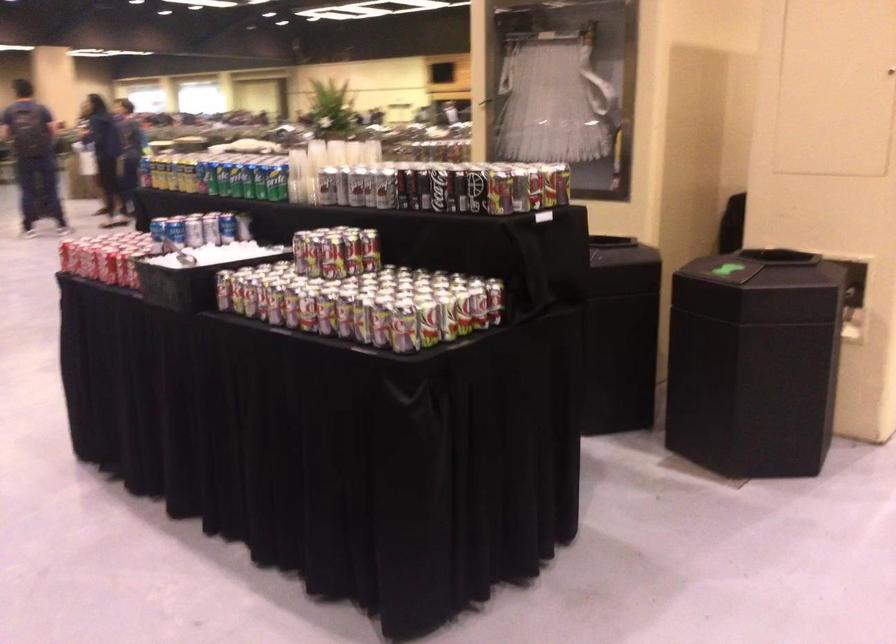
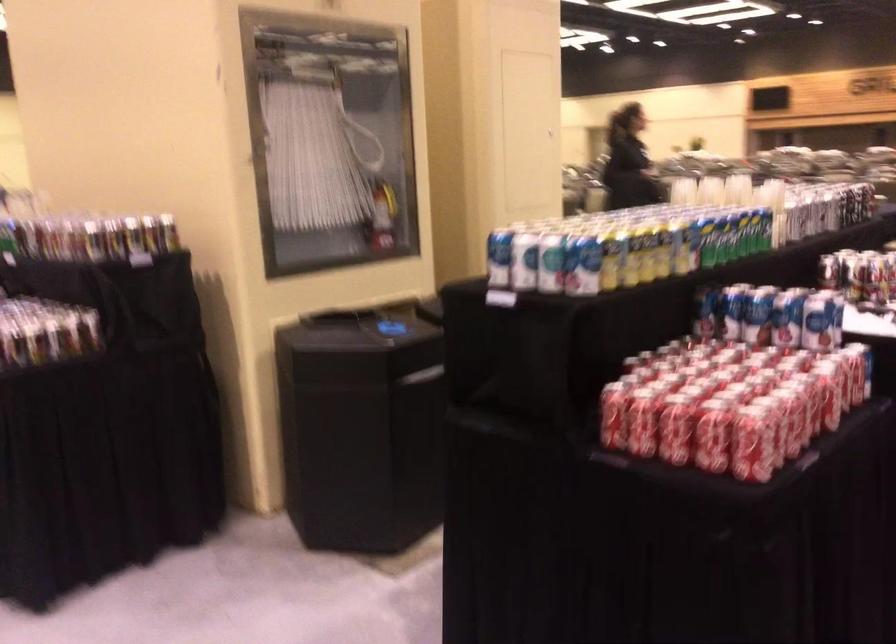
Where in the second image is the point corresponding to (207,169) from the first image?

(722, 238)